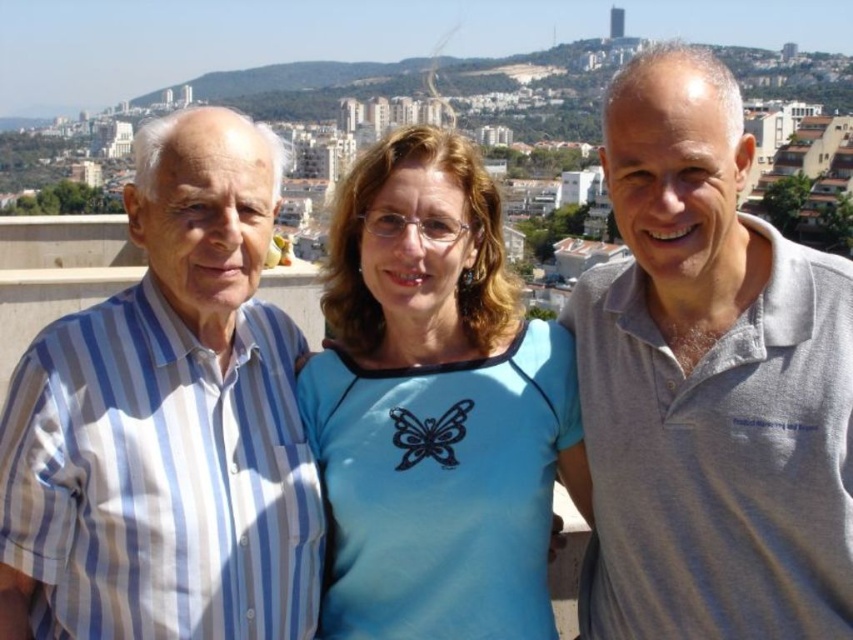
You are a photographer trying to capture a group photo of the blue striped shirt at left and the blue fabric shirt at center. Since you want to ensure both shirts are clearly visible, which shirt should you focus on first to avoid blurriness due to size differences?

The blue striped shirt at left is larger in size than the blue fabric shirt at center, so you should focus on the blue striped shirt at left first as it requires more detailed focus due to its larger size to ensure clarity.

You are standing on the balcony and want to take a photo of the cityscape. The blue striped shirt at left is blocking your view. How can you adjust your position to avoid the obstruction?

The blue striped shirt at left is located at point (167,422), so you can move to the right side of the balcony to avoid the obstruction caused by the blue striped shirt at left.

You are standing on the balcony and want to move from the point at coordinates point (733, 403) to the point at coordinates point (363, 502). Which direction should you move to reach your destination?

To move from point (733, 403) to point (363, 502), you should move towards the lower right direction since point (733, 403) is in front of point (363, 502).